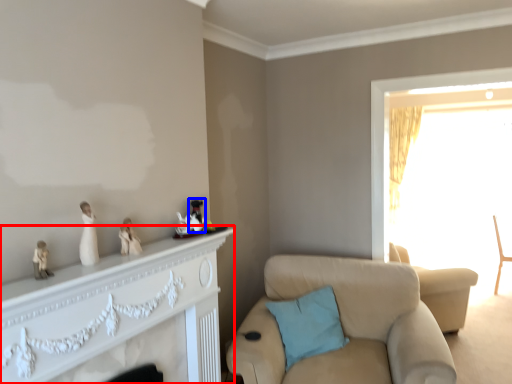
Question: Which point is closer to the camera, dresser (highlighted by a red box) or toy (highlighted by a blue box)?

Choices:
 (A) dresser
 (B) toy

Answer: (A)